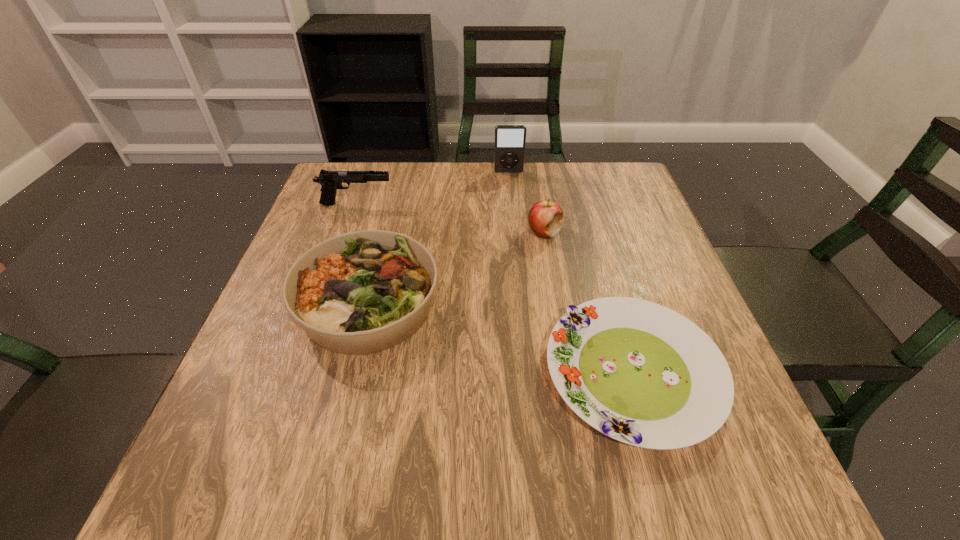
The image size is (960, 540). I want to click on vacant space that is in between the taller salad plate and the iPod, so (439, 238).

The height and width of the screenshot is (540, 960). I want to click on free spot between the left salad plate and the shorter salad plate, so click(500, 338).

The width and height of the screenshot is (960, 540). Find the location of `free space between the gun and the shorter salad plate`. free space between the gun and the shorter salad plate is located at coordinates (494, 288).

Where is `vacant space in between the iPod and the gun`? vacant space in between the iPod and the gun is located at coordinates [432, 188].

Image resolution: width=960 pixels, height=540 pixels. I want to click on empty space that is in between the shorter salad plate and the farthest object, so click(570, 272).

Find the location of `unoccupied position between the taller salad plate and the tallest object`. unoccupied position between the taller salad plate and the tallest object is located at coordinates (439, 238).

Locate which object is the second closest to the right salad plate. Please provide its 2D coordinates. Your answer should be formatted as a tuple, i.e. [(x, y)], where the tuple contains the x and y coordinates of a point satisfying the conditions above.

[(545, 217)]

Locate an element on the screen. This screenshot has width=960, height=540. object that is the fourth nearest to the right salad plate is located at coordinates (509, 152).

Where is `vacant area that satisfies the following two spatial constraints: 1. at the aiming end of the gun; 2. on the back side of the left salad plate`? vacant area that satisfies the following two spatial constraints: 1. at the aiming end of the gun; 2. on the back side of the left salad plate is located at coordinates (322, 303).

I want to click on vacant space that satisfies the following two spatial constraints: 1. at the aiming end of the right salad plate; 2. on the right side of the gun, so click(x=298, y=373).